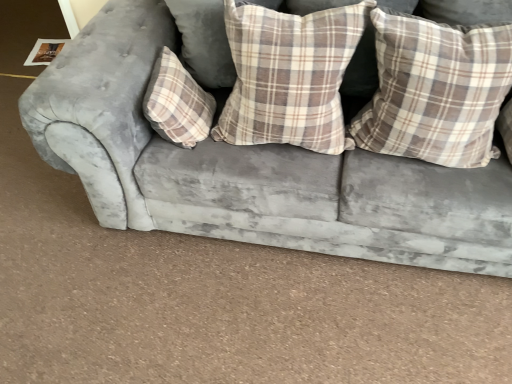
Question: From a real-world perspective, is plaid fabric pillow at center, the third pillow positioned from the right, physically above plaid fabric pillow at center, the second pillow when ordered from left to right?

Choices:
 (A) yes
 (B) no

Answer: (B)

Question: Could you tell me if plaid fabric pillow at center, the third pillow positioned from the right, is facing plaid fabric pillow at center, the 2th pillow from the right?

Choices:
 (A) yes
 (B) no

Answer: (A)

Question: Does plaid fabric pillow at center, the first pillow in the left-to-right sequence, appear on the left side of plaid fabric pillow at center, the second pillow when ordered from left to right?

Choices:
 (A) yes
 (B) no

Answer: (A)

Question: Considering the relative sizes of plaid fabric pillow at center, the first pillow in the left-to-right sequence, and plaid fabric pillow at center, the 2th pillow from the right, in the image provided, is plaid fabric pillow at center, the first pillow in the left-to-right sequence, smaller than plaid fabric pillow at center, the 2th pillow from the right,?

Choices:
 (A) yes
 (B) no

Answer: (A)

Question: Considering the relative positions of plaid fabric pillow at center, the third pillow positioned from the right, and plaid fabric pillow at center, the 2th pillow from the right, in the image provided, is plaid fabric pillow at center, the third pillow positioned from the right, in front of plaid fabric pillow at center, the 2th pillow from the right,?

Choices:
 (A) no
 (B) yes

Answer: (A)

Question: Is plaid fabric pillow at center, the second pillow when ordered from left to right, completely or partially inside plaid fabric pillow at center, the third pillow positioned from the right?

Choices:
 (A) no
 (B) yes

Answer: (A)

Question: Is plaid fabric pillow at center, the second pillow when ordered from left to right, taller than velvet gray couch at center?

Choices:
 (A) yes
 (B) no

Answer: (B)

Question: Is plaid fabric pillow at center, the 2th pillow from the right, bigger than velvet gray couch at center?

Choices:
 (A) no
 (B) yes

Answer: (A)

Question: Is plaid fabric pillow at center, the 2th pillow from the right, not close to velvet gray couch at center?

Choices:
 (A) yes
 (B) no

Answer: (B)

Question: From a real-world perspective, is plaid fabric pillow at center, the 2th pillow from the right, located beneath velvet gray couch at center?

Choices:
 (A) yes
 (B) no

Answer: (B)

Question: Considering the relative sizes of plaid fabric pillow at center, the 2th pillow from the right, and velvet gray couch at center in the image provided, is plaid fabric pillow at center, the 2th pillow from the right, thinner than velvet gray couch at center?

Choices:
 (A) no
 (B) yes

Answer: (B)

Question: Considering the relative sizes of plaid fabric pillow at center, the second pillow when ordered from left to right, and velvet gray couch at center in the image provided, is plaid fabric pillow at center, the second pillow when ordered from left to right, shorter than velvet gray couch at center?

Choices:
 (A) no
 (B) yes

Answer: (B)

Question: Does velvet gray couch at center come in front of plaid fabric pillow at center, the 2th pillow from the right?

Choices:
 (A) no
 (B) yes

Answer: (B)